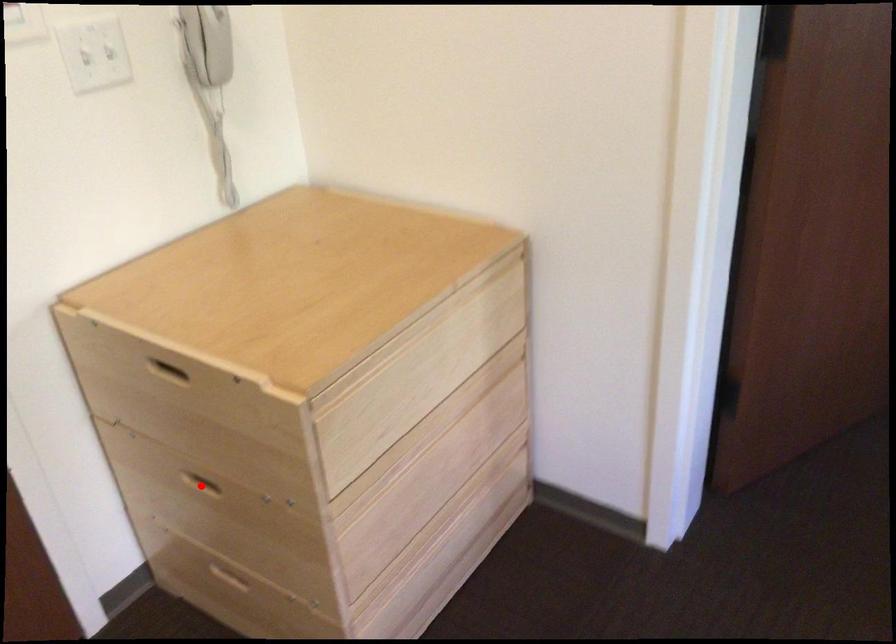
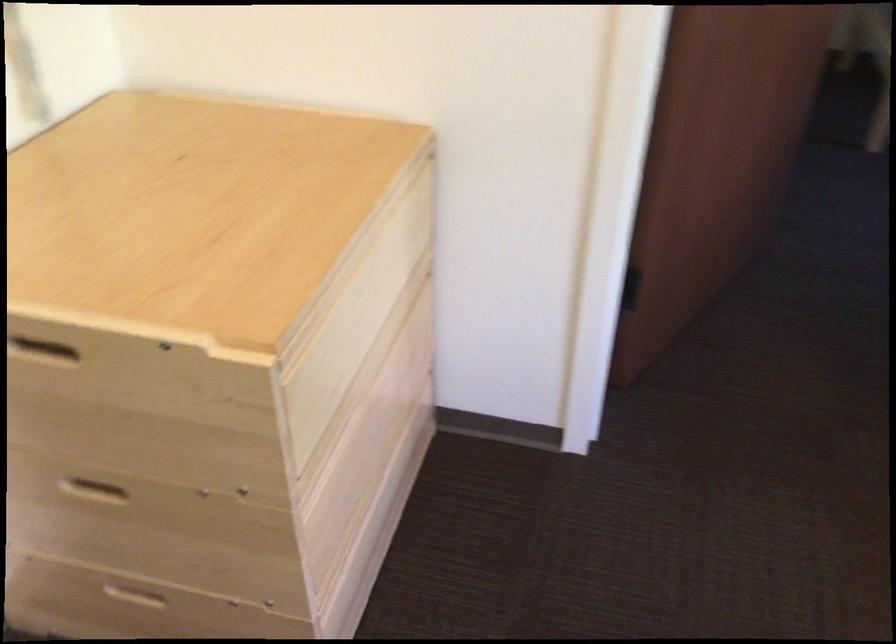
The point at the highlighted location is marked in the first image. Where is the corresponding point in the second image?

(90, 488)